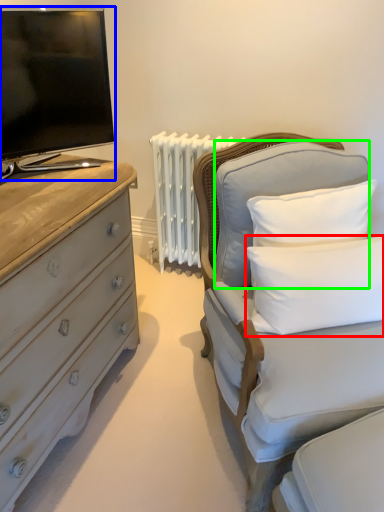
Question: Based on their relative distances, which object is farther from pillow (highlighted by a red box)? Choose from television (highlighted by a blue box) and pillow (highlighted by a green box).

Choices:
 (A) television
 (B) pillow

Answer: (A)